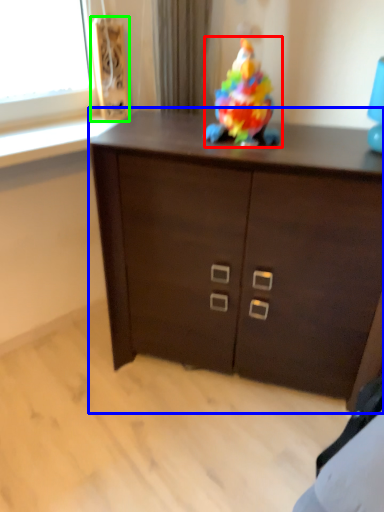
Question: Which object is positioned closest to toy (highlighted by a red box)? Select from chest of drawers (highlighted by a blue box) and speaker (highlighted by a green box).

Choices:
 (A) chest of drawers
 (B) speaker

Answer: (A)